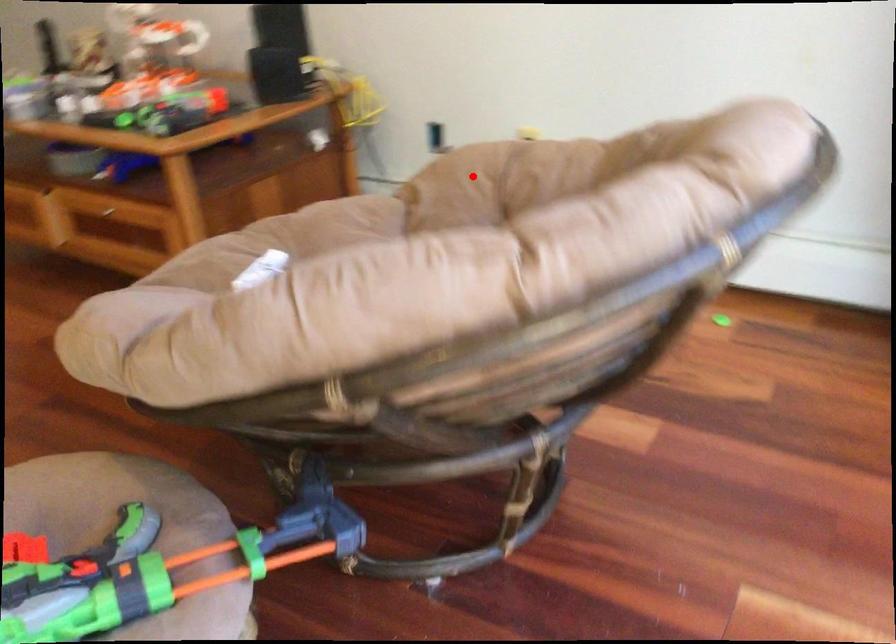
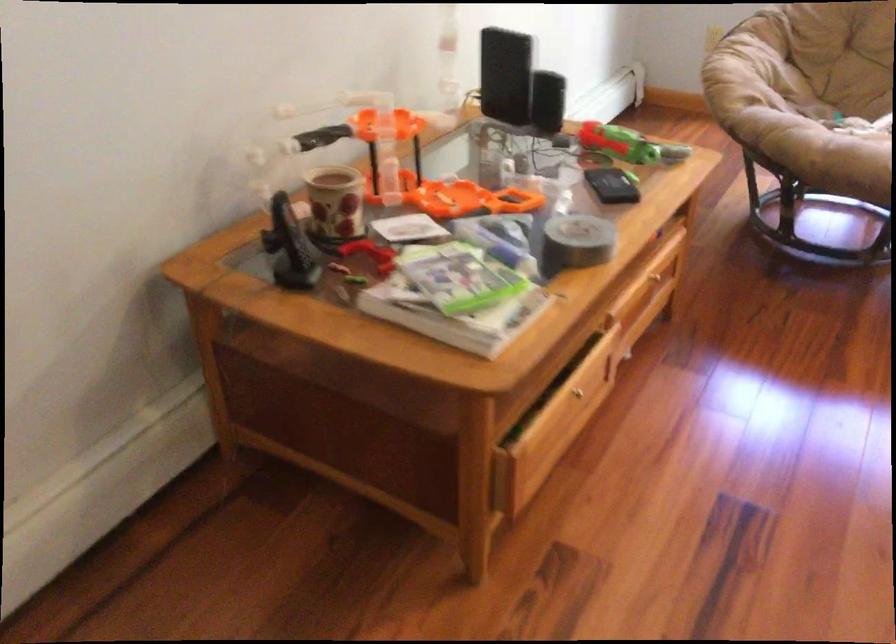
Question: I am providing you with two images of the same scene from different viewpoints. In image1, a red point is highlighted. Considering the same 3D point in image2, which of the following is correct?

Choices:
 (A) It is closer
 (B) It is farther

Answer: (B)